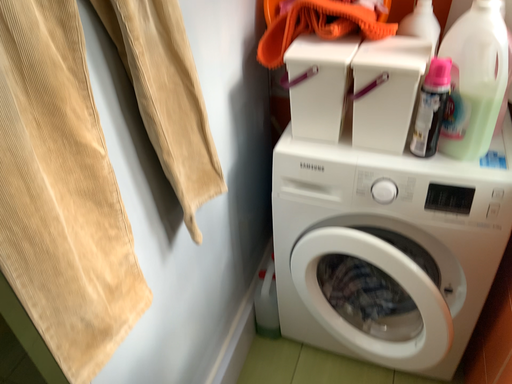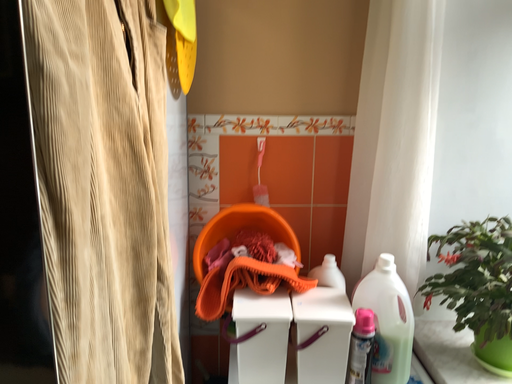
Question: How did the camera likely rotate when shooting the video?

Choices:
 (A) rotated right
 (B) rotated left

Answer: (A)